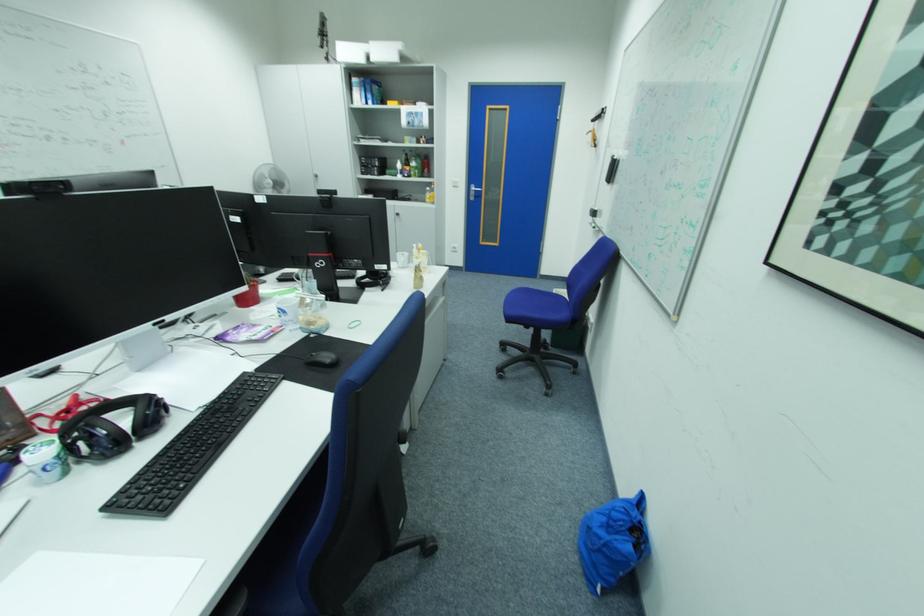
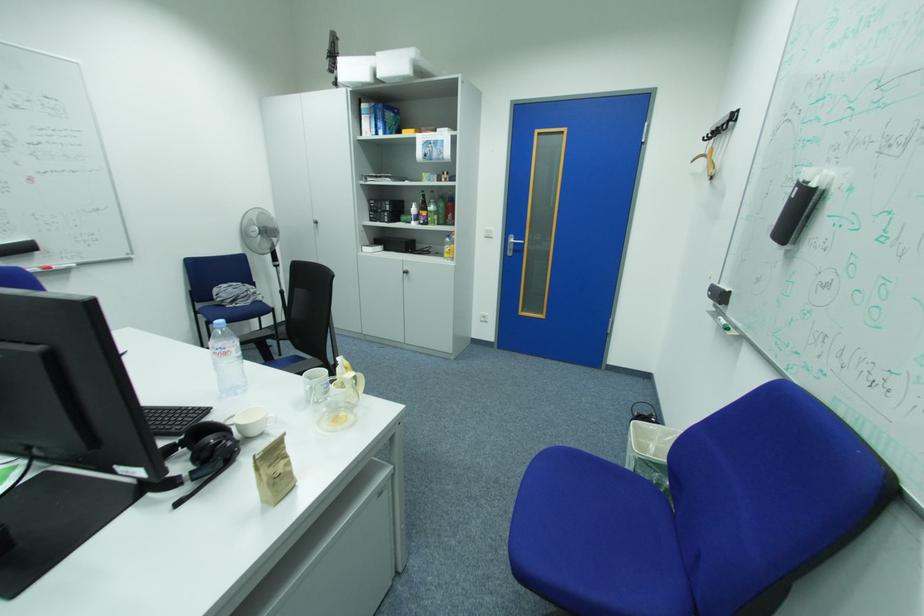
Find the pixel in the second image that matches point 407,216 in the first image.

(415, 273)